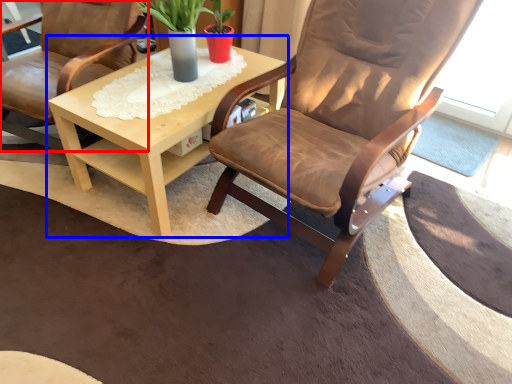
Question: Which of the following is the closest to the observer, chair (highlighted by a red box) or coffee table (highlighted by a blue box)?

Choices:
 (A) chair
 (B) coffee table

Answer: (A)